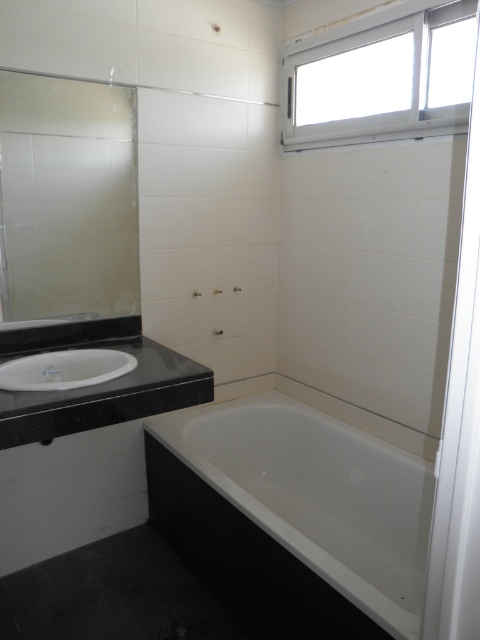
Looking at this image, which is below, white glossy bathtub at lower center or matte glass mirror at left?

Positioned lower is white glossy bathtub at lower center.

Is point (359, 580) closer to camera compared to point (95, 124)?

Yes, point (359, 580) is in front of point (95, 124).

You are a GUI agent. You are given a task and a screenshot of the screen. Output one action in this format:
    pyautogui.click(x=<x>, y=<y>)
    Task: Click on the white glossy bathtub at lower center
    The width and height of the screenshot is (480, 640).
    Given the screenshot: What is the action you would take?
    pyautogui.click(x=294, y=516)

Who is shorter, white plastic window at upper right or white glossy sink at lower left?

Standing shorter between the two is white glossy sink at lower left.

Is the position of white plastic window at upper right less distant than that of white glossy sink at lower left?

No, white plastic window at upper right is behind white glossy sink at lower left.

Who is more forward, (454, 100) or (28, 381)?

Positioned in front is point (454, 100).

Where is `white plastic window at upper right`? white plastic window at upper right is located at coordinates (381, 76).

Who is more distant from viewer, (305, 470) or (336, 120)?

The point (305, 470) is more distant.

Describe the element at coordinates (294, 516) in the screenshot. I see `white glossy bathtub at lower center` at that location.

At what (x,y) coordinates should I click in order to perform the action: click on white glossy bathtub at lower center. Please return your answer as a coordinate pair (x, y). This screenshot has width=480, height=640. Looking at the image, I should click on (294, 516).